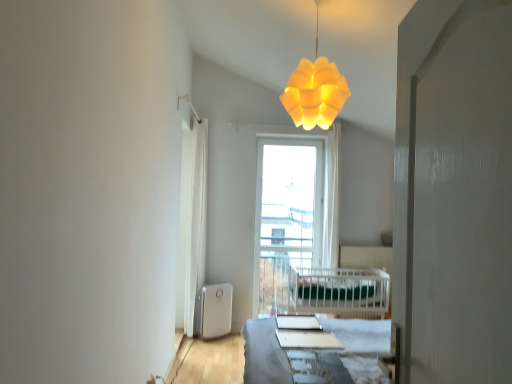
What is the approximate height of yellow matte lampshade at upper center?

yellow matte lampshade at upper center is 31.78 inches in height.

Identify the location of yellow matte lampshade at upper center. (315, 91).

Describe the element at coordinates (454, 192) in the screenshot. I see `white glossy screen door at right` at that location.

From the picture: Measure the distance between white glossy screen door at right and camera.

The distance of white glossy screen door at right from camera is 23.94 inches.

The height and width of the screenshot is (384, 512). Describe the element at coordinates (196, 224) in the screenshot. I see `white fabric curtain at left` at that location.

Measure the distance between point [212,330] and camera.

14.90 feet.

You are a GUI agent. You are given a task and a screenshot of the screen. Output one action in this format:
    pyautogui.click(x=<x>, y=<y>)
    Task: Click on the yellow matte lampshade at upper center
    The height and width of the screenshot is (384, 512).
    Given the screenshot: What is the action you would take?
    pyautogui.click(x=315, y=91)

Considering the relative sizes of white glossy screen door at right and transparent glass window at center in the image provided, is white glossy screen door at right taller than transparent glass window at center?

Result: No.

Where is `screen door on the right of transparent glass window at center`? This screenshot has width=512, height=384. screen door on the right of transparent glass window at center is located at coordinates (454, 192).

Between white glossy screen door at right and transparent glass window at center, which one has smaller width?

With smaller width is transparent glass window at center.

Is white glossy screen door at right positioned with its back to transparent glass window at center?

No, white glossy screen door at right is not facing the opposite direction of transparent glass window at center.

Choose the correct answer: Is white plastic water heater at lower left inside yellow matte lampshade at upper center or outside it?

The correct answer is: outside.

Can you confirm if white plastic water heater at lower left is shorter than yellow matte lampshade at upper center?

Indeed, white plastic water heater at lower left has a lesser height compared to yellow matte lampshade at upper center.

Is white plastic water heater at lower left further to the viewer compared to yellow matte lampshade at upper center?

Yes.

Is white plastic water heater at lower left looking in the opposite direction of yellow matte lampshade at upper center?

white plastic water heater at lower left does not have its back to yellow matte lampshade at upper center.

Is white glossy table at center positioned with its back to yellow matte lampshade at upper center?

white glossy table at center is not turned away from yellow matte lampshade at upper center.

Could yellow matte lampshade at upper center be considered to be inside white glossy table at center?

No, yellow matte lampshade at upper center is not a part of white glossy table at center.

From a real-world perspective, between white glossy table at center and yellow matte lampshade at upper center, who is vertically lower?

In real-world perspective, white glossy table at center is lower.

Is yellow matte lampshade at upper center at the right side of transparent glass window at center?

Yes, yellow matte lampshade at upper center is to the right of transparent glass window at center.

Is yellow matte lampshade at upper center inside or outside of transparent glass window at center?

yellow matte lampshade at upper center is outside transparent glass window at center.

How much distance is there between yellow matte lampshade at upper center and transparent glass window at center?

The distance of yellow matte lampshade at upper center from transparent glass window at center is 7.72 feet.

Who is smaller, yellow matte lampshade at upper center or white fabric curtain at left?

yellow matte lampshade at upper center.

Could you tell me if yellow matte lampshade at upper center is facing white fabric curtain at left?

No, yellow matte lampshade at upper center is not aimed at white fabric curtain at left.

Considering the relative sizes of yellow matte lampshade at upper center and white fabric curtain at left in the image provided, is yellow matte lampshade at upper center shorter than white fabric curtain at left?

Yes.

In the scene shown: Which point is more distant from viewer, (x=312, y=70) or (x=193, y=277)?

Point (x=193, y=277)

Can you confirm if white glossy table at center is positioned to the left of white glossy screen door at right?

Correct, you'll find white glossy table at center to the left of white glossy screen door at right.

Considering their positions, is white glossy table at center located in front of or behind white glossy screen door at right?

white glossy table at center is behind white glossy screen door at right.

From a real-world perspective, is white glossy table at center above or below white glossy screen door at right?

From a real-world perspective, white glossy table at center is physically below white glossy screen door at right.

From the image's perspective, which one is positioned higher, white glossy table at center or white glossy screen door at right?

white glossy screen door at right appears higher in the image.

Is transparent glass window at center aimed at white fabric curtain at left?

No, transparent glass window at center does not turn towards white fabric curtain at left.

Which is more to the right, transparent glass window at center or white fabric curtain at left?

Positioned to the right is transparent glass window at center.

Does transparent glass window at center come behind white fabric curtain at left?

Yes, the depth of transparent glass window at center is greater than that of white fabric curtain at left.

Identify the location of screen door above the transparent glass window at center (from a real-world perspective). The image size is (512, 384). (454, 192).

Identify the location of water heater below the yellow matte lampshade at upper center (from a real-world perspective). (215, 310).

When comparing their distances from white plastic water heater at lower left, does yellow matte lampshade at upper center or transparent glass window at center seem closer?

transparent glass window at center.

Estimate the real-world distances between objects in this image. Which object is closer to white plastic water heater at lower left, transparent glass window at center or white glossy screen door at right?

transparent glass window at center lies closer to white plastic water heater at lower left than the other object.

Which object lies nearer to the anchor point white plastic water heater at lower left, white fabric curtain at left or white glossy table at center?

white fabric curtain at left.

Looking at the image, which one is located closer to white glossy screen door at right, transparent glass window at center or white plastic water heater at lower left?

Based on the image, white plastic water heater at lower left appears to be nearer to white glossy screen door at right.

Considering their positions, is white fabric curtain at left positioned closer to white plastic water heater at lower left than transparent glass window at center?

white fabric curtain at left is closer to white plastic water heater at lower left.

From the image, which object appears to be nearer to yellow matte lampshade at upper center, white plastic water heater at lower left or white glossy screen door at right?

white glossy screen door at right is closer to yellow matte lampshade at upper center.

Considering their positions, is white glossy screen door at right positioned closer to yellow matte lampshade at upper center than white glossy table at center?

white glossy table at center.

Estimate the real-world distances between objects in this image. Which object is further from transparent glass window at center, white glossy table at center or white plastic water heater at lower left?

Among the two, white glossy table at center is located further to transparent glass window at center.

Identify the location of lamp between white glossy screen door at right and white glossy table at center in the front-back direction. This screenshot has height=384, width=512. (315, 91).

Where is `water heater between white fabric curtain at left and transparent glass window at center from left to right`? water heater between white fabric curtain at left and transparent glass window at center from left to right is located at coordinates (215, 310).

Image resolution: width=512 pixels, height=384 pixels. I want to click on water heater between white glossy table at center and white fabric curtain at left from front to back, so click(215, 310).

Image resolution: width=512 pixels, height=384 pixels. I want to click on table between white glossy screen door at right and transparent glass window at center from front to back, so coord(304,333).